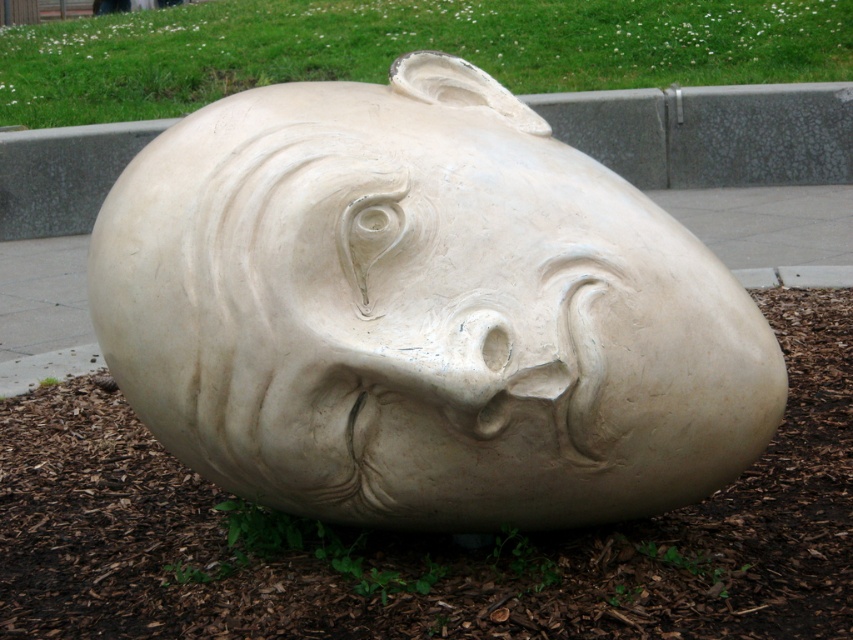
Question: Does white stone sculpture at center lie behind green grass at upper center?

Choices:
 (A) no
 (B) yes

Answer: (A)

Question: In this image, where is white stone sculpture at center located relative to green grass at upper center?

Choices:
 (A) above
 (B) below

Answer: (B)

Question: Observing the image, what is the correct spatial positioning of white stone sculpture at center in reference to green grass at upper center?

Choices:
 (A) right
 (B) left

Answer: (B)